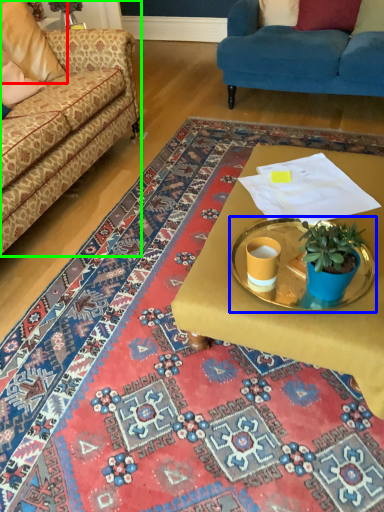
Question: Based on their relative distances, which object is nearer to pillow (highlighted by a red box)? Choose from round table (highlighted by a blue box) and studio couch (highlighted by a green box).

Choices:
 (A) round table
 (B) studio couch

Answer: (B)